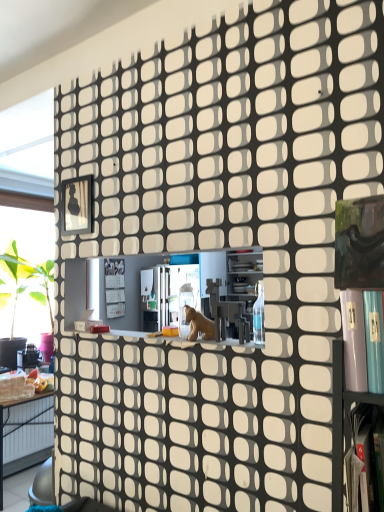
Question: In terms of size, does metallic silver shelf at lower right appear bigger or smaller than metallic frame at upper left?

Choices:
 (A) big
 (B) small

Answer: (A)

Question: Is point (352, 398) positioned closer to the camera than point (64, 195)?

Choices:
 (A) farther
 (B) closer

Answer: (B)

Question: Estimate the real-world distances between objects in this image. Which object is closer to the metallic frame at upper left?

Choices:
 (A) brown matte animal at center
 (B) metallic silver shelf at lower right

Answer: (A)

Question: Estimate the real-world distances between objects in this image. Which object is closer to the metallic silver shelf at lower right?

Choices:
 (A) brown matte animal at center
 (B) metallic frame at upper left

Answer: (A)